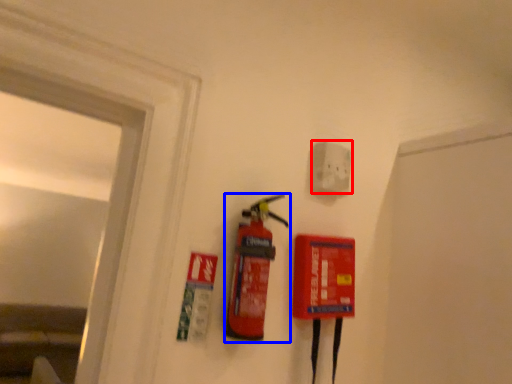
Question: Which object appears farthest to the camera in this image, electric outlet (highlighted by a red box) or fire extinguisher (highlighted by a blue box)?

Choices:
 (A) electric outlet
 (B) fire extinguisher

Answer: (A)